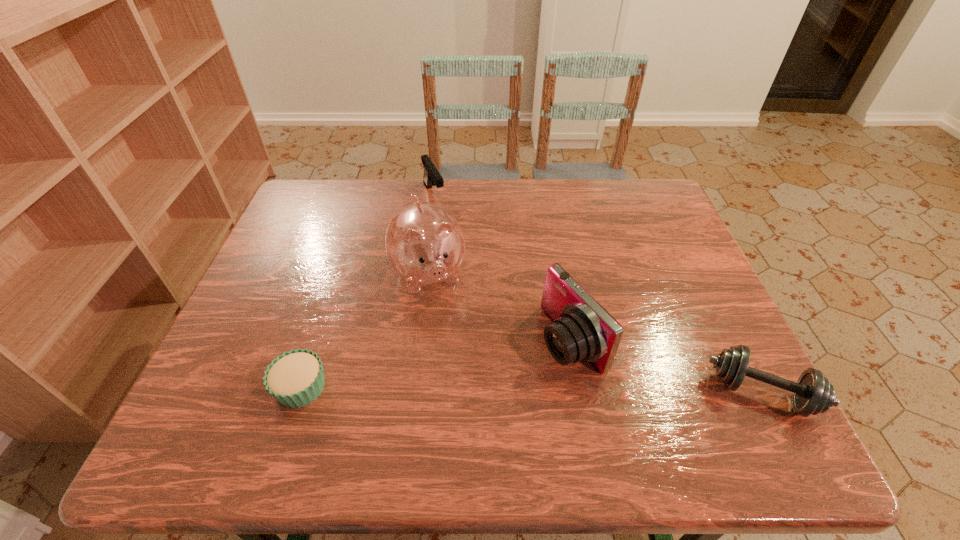
At what (x,y) coordinates should I click in order to perform the action: click on the shortest object. Please return your answer as a coordinate pair (x, y). Looking at the image, I should click on (296, 378).

Locate an element on the screen. cupcake is located at coordinates (296, 378).

Where is `dumbbell`? This screenshot has height=540, width=960. dumbbell is located at coordinates (812, 393).

Where is `the fourth object from left to right`? This screenshot has width=960, height=540. the fourth object from left to right is located at coordinates (582, 330).

Where is `the fourth shortest object`? The image size is (960, 540). the fourth shortest object is located at coordinates (582, 330).

Find the location of `the farthest object`. the farthest object is located at coordinates (431, 177).

Locate an element on the screen. The width and height of the screenshot is (960, 540). the tallest object is located at coordinates (425, 245).

I want to click on vacant space positioned 0.080m on the back of the cupcake, so click(x=318, y=334).

Locate an element on the screen. This screenshot has width=960, height=540. free location located 0.270m on the back of the dumbbell is located at coordinates (702, 274).

At what (x,y) coordinates should I click in order to perform the action: click on vacant point located 0.140m on the front-facing side of the second object from right to left. Please return your answer as a coordinate pair (x, y). Image resolution: width=960 pixels, height=540 pixels. Looking at the image, I should click on (490, 389).